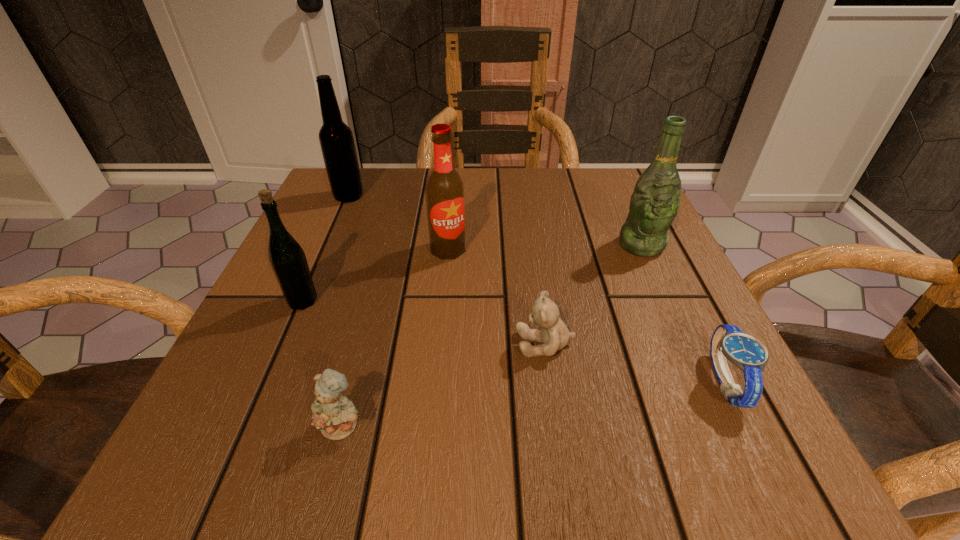
The height and width of the screenshot is (540, 960). What are the coordinates of `watch that is at the near edge` in the screenshot? It's located at (728, 341).

The image size is (960, 540). In order to click on beer bottle positioned at the right edge in this screenshot , I will do `click(654, 204)`.

Where is `watch located at the right edge`? The height and width of the screenshot is (540, 960). watch located at the right edge is located at coordinates (728, 341).

You are a GUI agent. You are given a task and a screenshot of the screen. Output one action in this format:
    pyautogui.click(x=<x>, y=<y>)
    Task: Click on the object at the far left corner
    Image resolution: width=960 pixels, height=540 pixels.
    Given the screenshot: What is the action you would take?
    pyautogui.click(x=337, y=144)

This screenshot has height=540, width=960. Find the location of `object that is at the near right corner`. object that is at the near right corner is located at coordinates click(x=728, y=341).

Locate an element on the screen. vacant area at the far edge of the desktop is located at coordinates (474, 214).

In the image, there is a desktop. Identify the location of vacant space at the left edge. This screenshot has width=960, height=540. (226, 364).

I want to click on free spot at the right edge of the desktop, so click(671, 343).

In the image, there is a desktop. Where is `free space at the far left corner`? Image resolution: width=960 pixels, height=540 pixels. free space at the far left corner is located at coordinates (377, 186).

This screenshot has width=960, height=540. Identify the location of free region at the far right corner of the desktop. (612, 205).